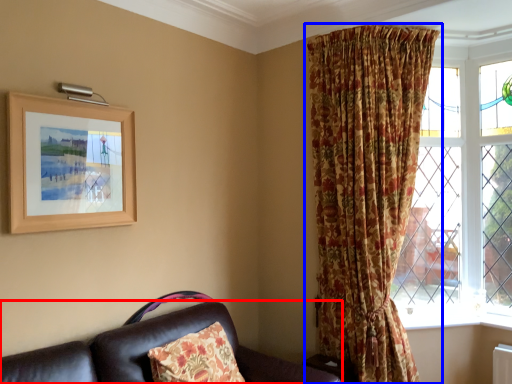
Question: Which object is further to the camera taking this photo, studio couch (highlighted by a red box) or curtain (highlighted by a blue box)?

Choices:
 (A) studio couch
 (B) curtain

Answer: (B)